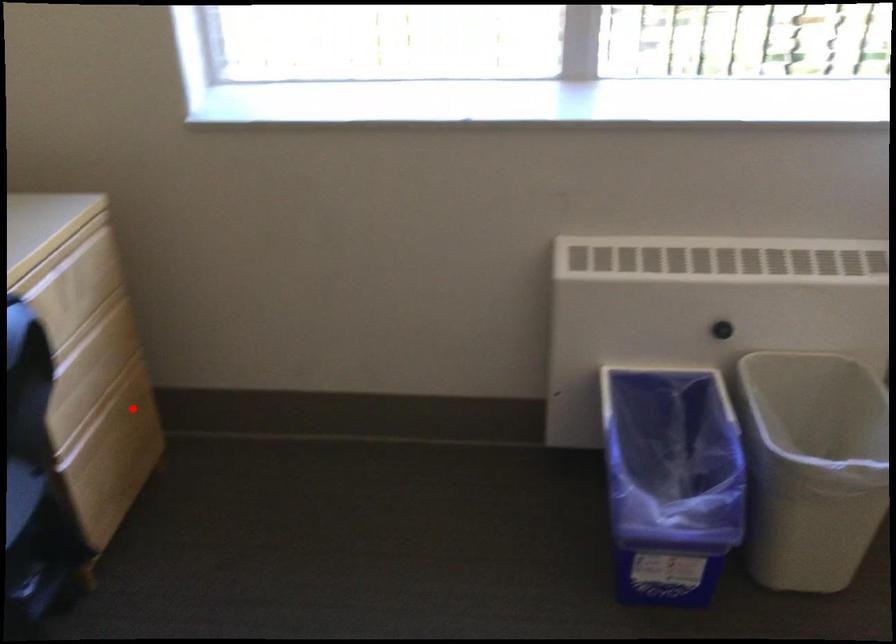
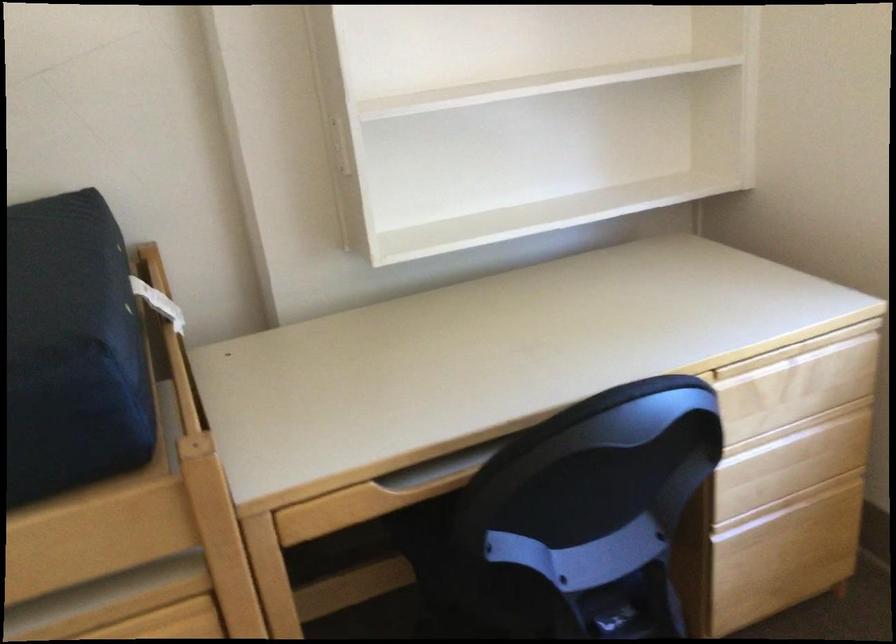
Question: I am providing you with two images of the same scene from different viewpoints. A red point is shown in image1. For the corresponding object point in image2, is it positioned nearer or farther from the camera?

Choices:
 (A) Nearer
 (B) Farther

Answer: (A)